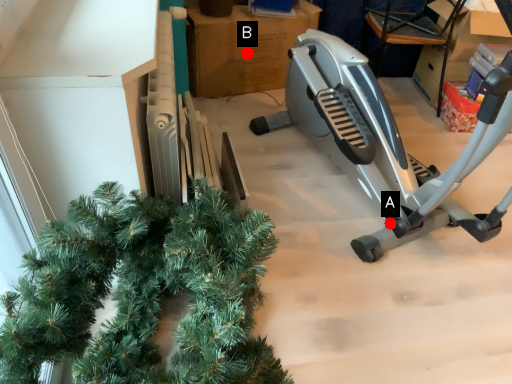
Question: Two points are circled on the image, labeled by A and B beside each circle. Which point is closer to the camera?

Choices:
 (A) A is closer
 (B) B is closer

Answer: (A)